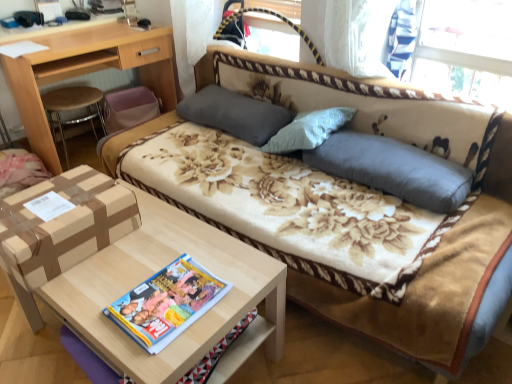
Question: Is brown cardboard box at lower left taller than floral fabric studio couch at center?

Choices:
 (A) no
 (B) yes

Answer: (A)

Question: Does brown cardboard box at lower left have a larger size compared to floral fabric studio couch at center?

Choices:
 (A) no
 (B) yes

Answer: (A)

Question: Could you tell me if brown cardboard box at lower left is facing floral fabric studio couch at center?

Choices:
 (A) no
 (B) yes

Answer: (A)

Question: Would you say brown cardboard box at lower left is outside floral fabric studio couch at center?

Choices:
 (A) yes
 (B) no

Answer: (A)

Question: Are brown cardboard box at lower left and floral fabric studio couch at center beside each other?

Choices:
 (A) yes
 (B) no

Answer: (B)

Question: From their relative heights in the image, would you say gray fabric pillow at center, the first pillow viewed from the left, is taller or shorter than floral fabric studio couch at center?

Choices:
 (A) tall
 (B) short

Answer: (B)

Question: Does point coord(246,140) appear closer or farther from the camera than point coord(207,46)?

Choices:
 (A) closer
 (B) farther

Answer: (A)

Question: Is gray fabric pillow at center, which appears as the second pillow when viewed from the front, in front of or behind floral fabric studio couch at center in the image?

Choices:
 (A) behind
 (B) front

Answer: (A)

Question: Is gray fabric pillow at center, marked as the 2th pillow in a right-to-left arrangement, inside the boundaries of floral fabric studio couch at center, or outside?

Choices:
 (A) outside
 (B) inside

Answer: (B)

Question: Looking at the image, does multicolored glossy magazine at center seem bigger or smaller compared to light brown wood table at lower left?

Choices:
 (A) small
 (B) big

Answer: (A)

Question: From a real-world perspective, is multicolored glossy magazine at center above or below light brown wood table at lower left?

Choices:
 (A) below
 (B) above

Answer: (B)

Question: In terms of width, does multicolored glossy magazine at center look wider or thinner when compared to light brown wood table at lower left?

Choices:
 (A) wide
 (B) thin

Answer: (B)

Question: Is multicolored glossy magazine at center taller or shorter than light brown wood table at lower left?

Choices:
 (A) tall
 (B) short

Answer: (B)

Question: Does point (422, 157) appear closer or farther from the camera than point (244, 107)?

Choices:
 (A) closer
 (B) farther

Answer: (A)

Question: Would you say gray fabric pillow at center, the second pillow in the left-to-right sequence, is to the left or to the right of gray fabric pillow at center, which appears as the second pillow when viewed from the front, in the picture?

Choices:
 (A) right
 (B) left

Answer: (A)